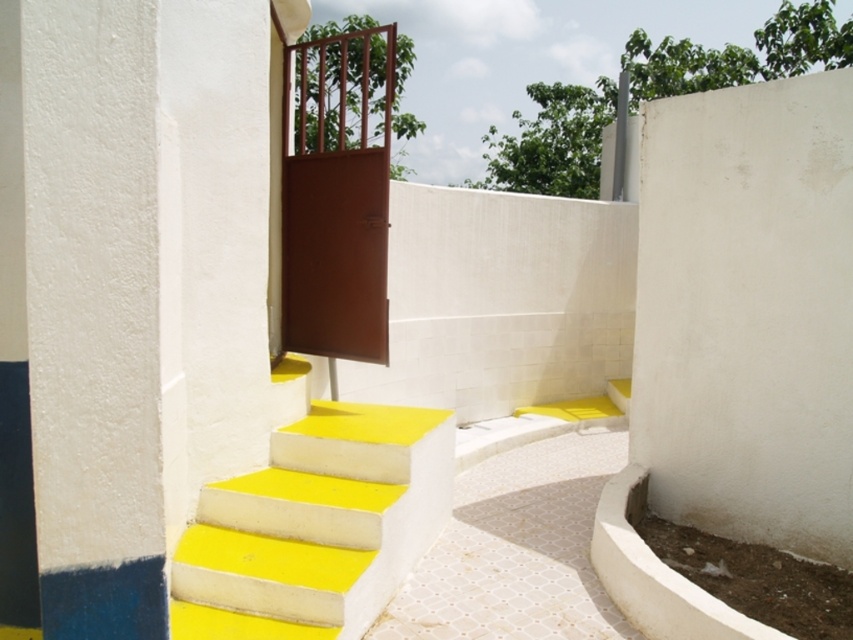
Can you confirm if yellow painted concrete stairs at center is taller than brown matte door at center?

In fact, yellow painted concrete stairs at center may be shorter than brown matte door at center.

From the picture: Does yellow painted concrete stairs at center have a smaller size compared to brown matte door at center?

No.

Is point (215, 605) farther from viewer compared to point (314, 301)?

No, it is not.

Locate an element on the screen. The height and width of the screenshot is (640, 853). yellow painted concrete stairs at center is located at coordinates (315, 525).

Can you confirm if white smooth pillar at left is bigger than brown matte door at center?

No, white smooth pillar at left is not bigger than brown matte door at center.

Describe the element at coordinates (79, 321) in the screenshot. I see `white smooth pillar at left` at that location.

Locate an element on the screen. This screenshot has width=853, height=640. white smooth pillar at left is located at coordinates (79, 321).

Is white smooth pillar at left wider than yellow painted concrete stairs at center?

No, white smooth pillar at left is not wider than yellow painted concrete stairs at center.

Does point (108, 305) lie in front of point (328, 596)?

Yes, it is in front of point (328, 596).

Measure the distance between white smooth pillar at left and camera.

white smooth pillar at left is 6.70 feet from camera.

Locate an element on the screen. This screenshot has height=640, width=853. white smooth pillar at left is located at coordinates (79, 321).